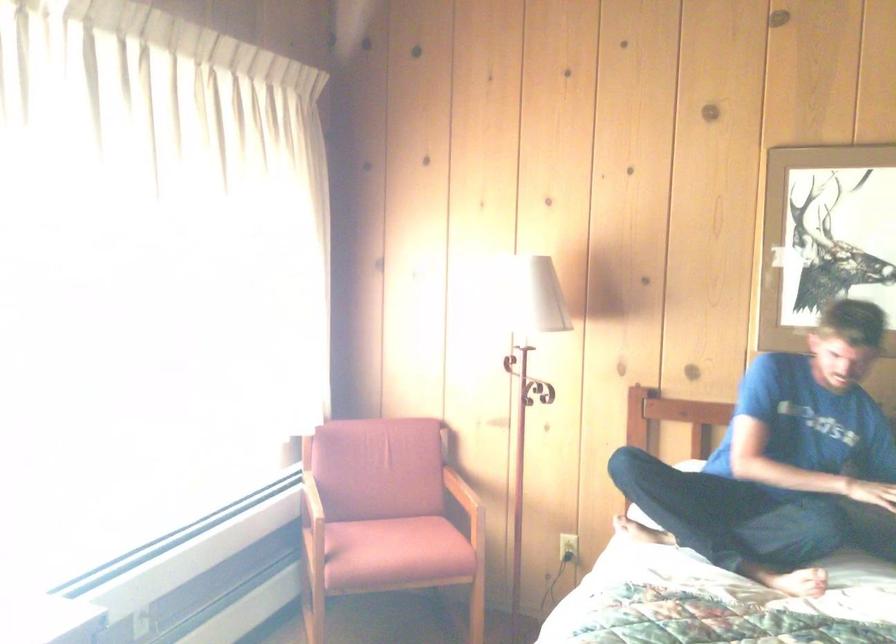
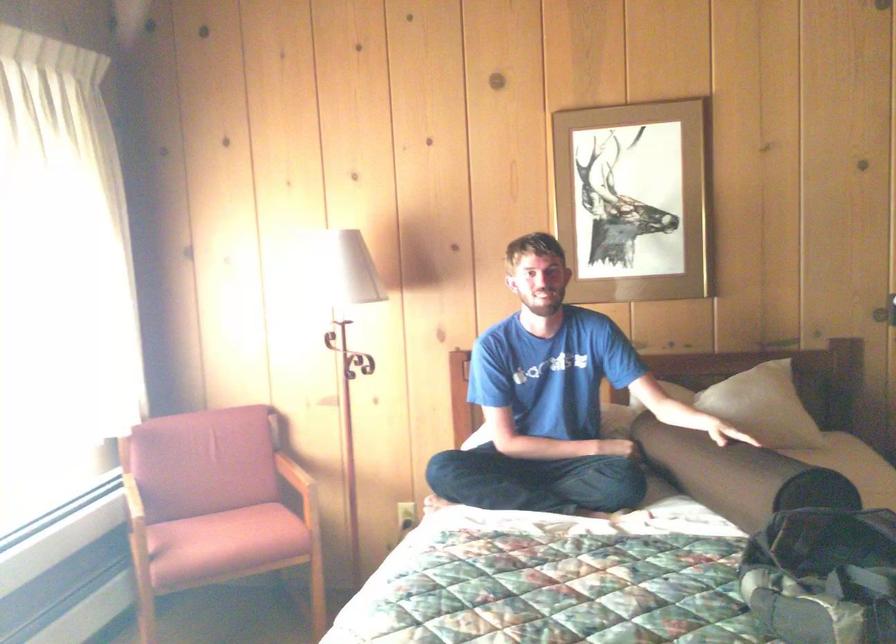
Question: The camera is either moving clockwise (left) or counter-clockwise (right) around the object. The first image is from the beginning of the video and the second image is from the end. Is the camera moving left or right when shooting the video?

Choices:
 (A) Left
 (B) Right

Answer: (A)